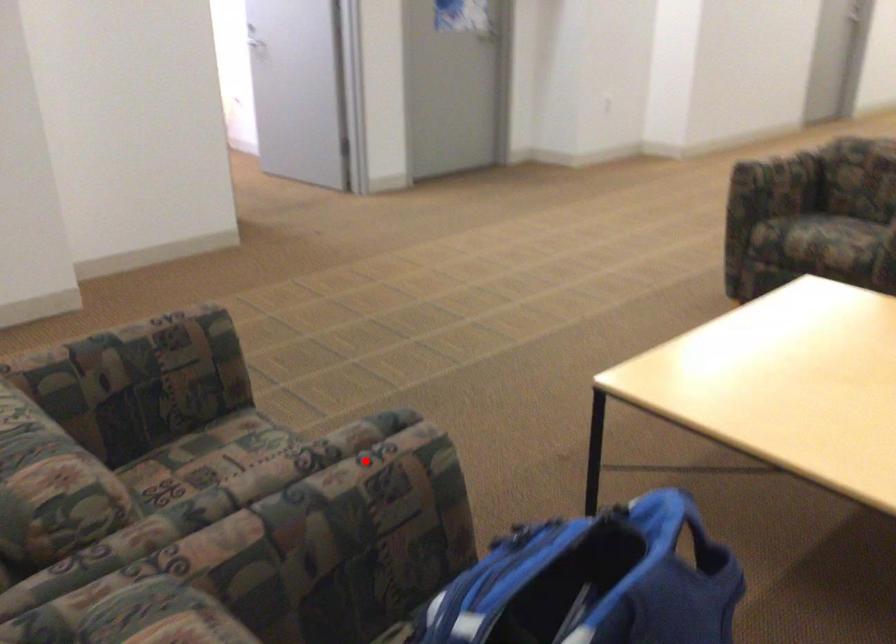
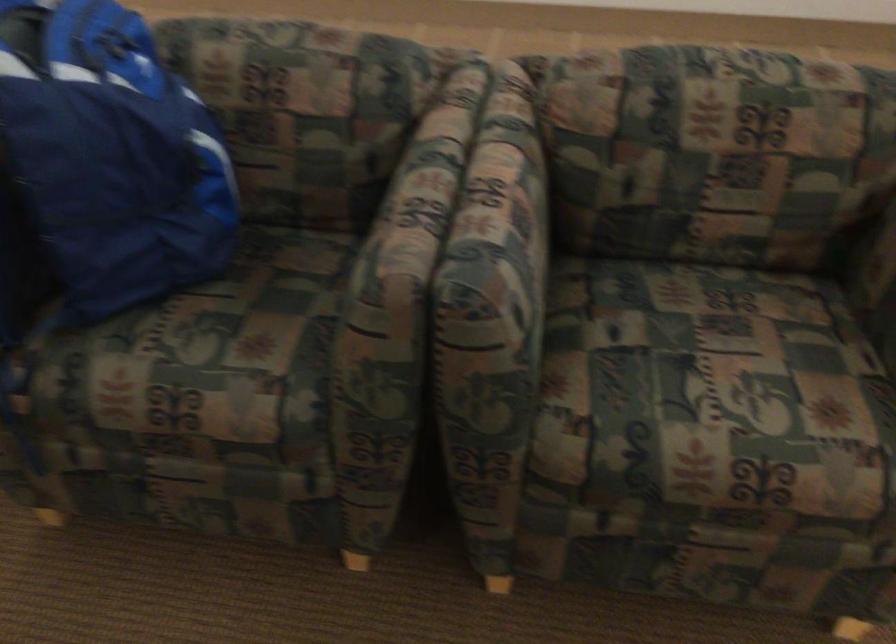
Question: I am providing you with two images of the same scene from different viewpoints. Image1 has a red point marked. In image2, the corresponding 3D location appears at what relative position? Reply with the corresponding letter.

Choices:
 (A) Closer
 (B) Farther

Answer: (A)